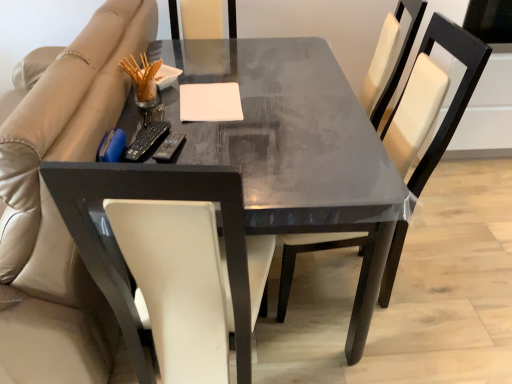
Identify the location of matte black table at center. The image size is (512, 384). (297, 151).

What are the coordinates of `white leather chair at center` in the screenshot? It's located at (432, 100).

The width and height of the screenshot is (512, 384). What do you see at coordinates (432, 100) in the screenshot?
I see `white leather chair at center` at bounding box center [432, 100].

The image size is (512, 384). What do you see at coordinates (56, 207) in the screenshot? I see `beige leather couch at left` at bounding box center [56, 207].

Measure the distance between beige leather couch at left and camera.

beige leather couch at left and camera are 37.39 inches apart.

Image resolution: width=512 pixels, height=384 pixels. I want to click on matte black table at center, so click(297, 151).

In terms of width, does white leather chair at center look wider or thinner when compared to black plastic remote at left?

In the image, white leather chair at center appears to be wider than black plastic remote at left.

Based on the photo, from a real-world perspective, between white leather chair at center and black plastic remote at left, who is vertically lower?

white leather chair at center, from a real-world perspective.

Identify the location of remote above the white leather chair at center (from the image's perspective). This screenshot has width=512, height=384. (146, 140).

Considering the relative sizes of white leather chair at center and black plastic remote at left in the image provided, is white leather chair at center taller than black plastic remote at left?

Correct, white leather chair at center is much taller as black plastic remote at left.

From the picture: Considering the sizes of objects white matte notepad at center and matte black table at center in the image provided, who is thinner, white matte notepad at center or matte black table at center?

white matte notepad at center.

Is white matte notepad at center oriented away from matte black table at center?

Yes, matte black table at center is at the back of white matte notepad at center.

You are a GUI agent. You are given a task and a screenshot of the screen. Output one action in this format:
    pyautogui.click(x=<x>, y=<y>)
    Task: Click on the chair that is behind the beige leather couch at left
    The height and width of the screenshot is (384, 512).
    Given the screenshot: What is the action you would take?
    pyautogui.click(x=432, y=100)

Is the depth of white leather chair at center greater than that of beige leather couch at left?

That is True.

Considering the sizes of white leather chair at center and beige leather couch at left in the image, is white leather chair at center bigger or smaller than beige leather couch at left?

In the image, white leather chair at center appears to be smaller than beige leather couch at left.

Measure the distance between matte black table at center and white matte notepad at center.

matte black table at center and white matte notepad at center are 9.86 inches apart.

What's the angular difference between matte black table at center and white matte notepad at center's facing directions?

2.79 degrees.

Considering the relative sizes of matte black table at center and white matte notepad at center in the image provided, is matte black table at center thinner than white matte notepad at center?

No.

Is matte black table at center to the right of white matte notepad at center from the viewer's perspective?

Indeed, matte black table at center is positioned on the right side of white matte notepad at center.

Based on the photo, does beige leather couch at left turn towards white leather chair at center?

No, beige leather couch at left does not turn towards white leather chair at center.

Is point (116, 20) positioned behind point (425, 166)?

That is True.

You are a GUI agent. You are given a task and a screenshot of the screen. Output one action in this format:
    pyautogui.click(x=<x>, y=<y>)
    Task: Click on the chair located on the right of beige leather couch at left
    
    Given the screenshot: What is the action you would take?
    pyautogui.click(x=432, y=100)

Considering the relative positions of beige leather couch at left and white leather chair at center in the image provided, is beige leather couch at left to the right of white leather chair at center from the viewer's perspective?

In fact, beige leather couch at left is to the left of white leather chair at center.

From the image's perspective, is white matte notepad at center below beige leather couch at left?

No.

This screenshot has width=512, height=384. I want to click on notepad on the right side of beige leather couch at left, so click(x=210, y=102).

Looking at this image, from a real-world perspective, is white matte notepad at center physically located above or below beige leather couch at left?

From a real-world perspective, white matte notepad at center is physically above beige leather couch at left.

What's the angular difference between white matte notepad at center and beige leather couch at left's facing directions?

The angular difference between white matte notepad at center and beige leather couch at left is 177 degrees.

From the image's perspective, which one is positioned lower, beige leather couch at left or white matte notepad at center?

beige leather couch at left.

From a real-world perspective, is beige leather couch at left above or below white matte notepad at center?

beige leather couch at left is situated lower than white matte notepad at center in the real world.

Does beige leather couch at left come behind white matte notepad at center?

That is False.

Between beige leather couch at left and white matte notepad at center, which one has smaller size?

white matte notepad at center is smaller.

In the image, there is a black plastic remote at left. Where is `chair below it (from a real-world perspective)`? Image resolution: width=512 pixels, height=384 pixels. chair below it (from a real-world perspective) is located at coordinates (432, 100).

Locate an element on the screen. notepad that appears above the matte black table at center (from a real-world perspective) is located at coordinates tap(210, 102).

When comparing their distances from matte black table at center, does black plastic remote at left or white leather chair at center seem further?

Among the two, black plastic remote at left is located further to matte black table at center.

Considering their positions, is matte black table at center positioned closer to white matte notepad at center than black plastic remote at left?

Among the two, black plastic remote at left is located nearer to white matte notepad at center.

From the image, which object appears to be nearer to black plastic remote at left, white leather chair at center or matte black table at center?

Based on the image, matte black table at center appears to be nearer to black plastic remote at left.

Looking at the image, which one is located closer to white leather chair at center, beige leather couch at left or white matte notepad at center?

white matte notepad at center lies closer to white leather chair at center than the other object.

Considering their positions, is white leather chair at center positioned closer to beige leather couch at left than matte black table at center?

Among the two, matte black table at center is located nearer to beige leather couch at left.

When comparing their distances from white matte notepad at center, does white leather chair at center or black plastic remote at left seem further?

Among the two, white leather chair at center is located further to white matte notepad at center.

Considering their positions, is white matte notepad at center positioned further to beige leather couch at left than matte black table at center?

Based on the image, matte black table at center appears to be further to beige leather couch at left.

From the image, which object appears to be nearer to white matte notepad at center, beige leather couch at left or black plastic remote at left?

black plastic remote at left lies closer to white matte notepad at center than the other object.

Where is `table between beige leather couch at left and white leather chair at center from left to right`? The height and width of the screenshot is (384, 512). table between beige leather couch at left and white leather chair at center from left to right is located at coordinates (297, 151).

Image resolution: width=512 pixels, height=384 pixels. Identify the location of notepad between black plastic remote at left and white leather chair at center in the horizontal direction. (210, 102).

Where is `table between black plastic remote at left and white leather chair at center in the horizontal direction`? The width and height of the screenshot is (512, 384). table between black plastic remote at left and white leather chair at center in the horizontal direction is located at coordinates (297, 151).

This screenshot has width=512, height=384. What are the coordinates of `notepad situated between beige leather couch at left and white leather chair at center from left to right` in the screenshot? It's located at (210, 102).